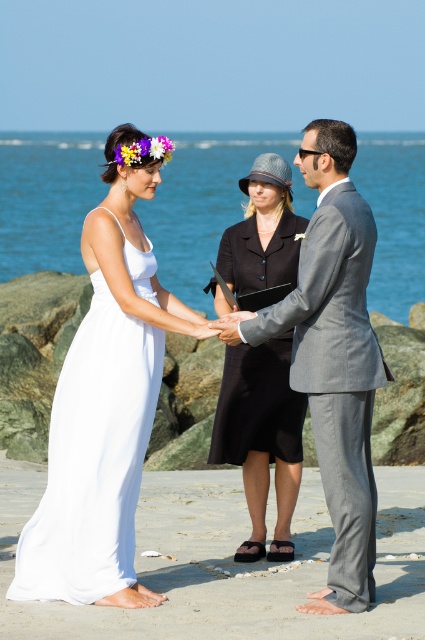
Does point (125, 333) come behind point (85, 376)?

Yes.

Between point (314, 168) and point (56, 518), which one is positioned in front?

Point (314, 168) is in front.

Is point (331, 609) closer to camera compared to point (127, 580)?

Yes, point (331, 609) is in front of point (127, 580).

The width and height of the screenshot is (425, 640). Find the location of `white satin dress at center`. white satin dress at center is located at coordinates (212, 336).

Which is more to the left, gray suit at center or black matte dress at center?

black matte dress at center is more to the left.

Can you confirm if gray suit at center is bigger than black matte dress at center?

Correct, gray suit at center is larger in size than black matte dress at center.

Describe the element at coordinates (333, 356) in the screenshot. The width and height of the screenshot is (425, 640). I see `gray suit at center` at that location.

At what (x,y) coordinates should I click in order to perform the action: click on gray suit at center. Please return your answer as a coordinate pair (x, y). This screenshot has height=640, width=425. Looking at the image, I should click on (333, 356).

Can you confirm if white satin dress at center is wider than gray suit at center?

Correct, the width of white satin dress at center exceeds that of gray suit at center.

Image resolution: width=425 pixels, height=640 pixels. What do you see at coordinates (212, 336) in the screenshot?
I see `white satin dress at center` at bounding box center [212, 336].

This screenshot has width=425, height=640. Identify the location of white satin dress at center. (212, 336).